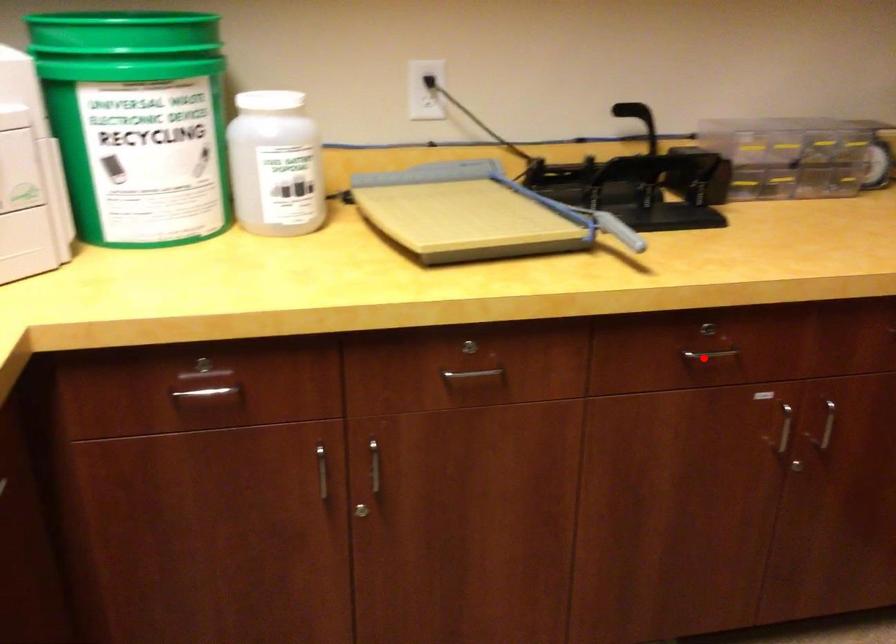
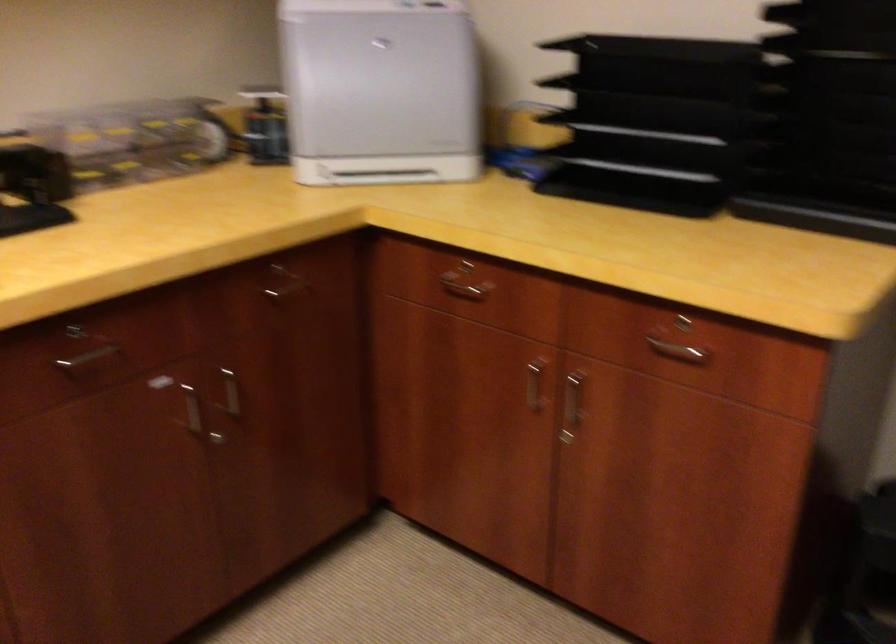
Find the pixel in the second image that matches the highlighted location in the first image.

(90, 355)